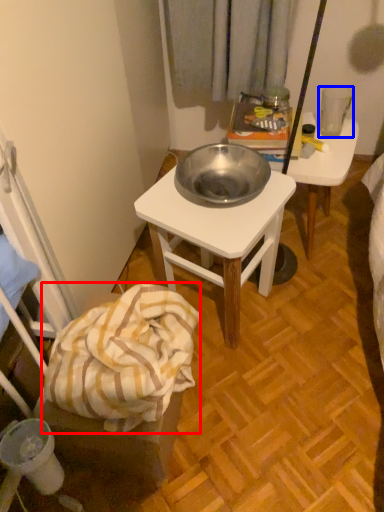
Question: Which object appears farthest to the camera in this image, blanket (highlighted by a red box) or coffee cup (highlighted by a blue box)?

Choices:
 (A) blanket
 (B) coffee cup

Answer: (B)